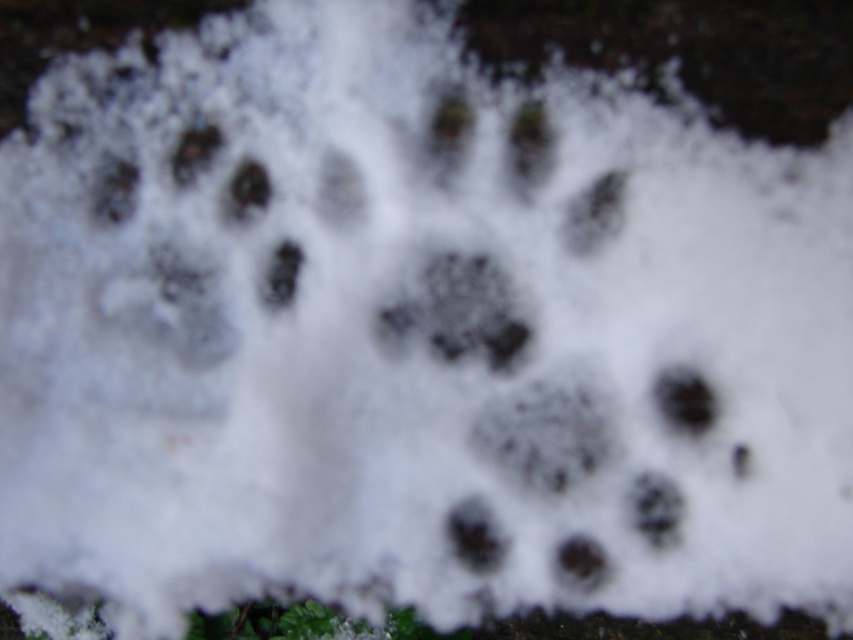
Looking at this image, you are a wildlife researcher examining the scene. You notice the dark textured paw print at center. Based on its position, can you determine if it is located near the center of the scene?

Yes, the dark textured paw print at center is located at point coordinates of approximately (461, 308), which is very close to the center of the scene.

You are a wildlife tracker analyzing the scene. You notice the dark textured paw print at center and the black rubber footprint at lower right. Which of these two footprints is taller?

The dark textured paw print at center has a greater height compared to the black rubber footprint at lower right, so the dark textured paw print at center is taller.